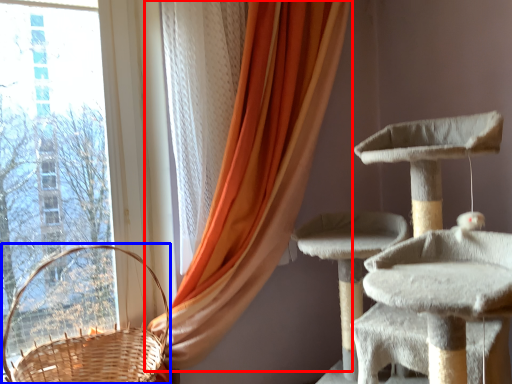
Question: Which of the following is the farthest to the observer, curtain (highlighted by a red box) or basket (highlighted by a blue box)?

Choices:
 (A) curtain
 (B) basket

Answer: (A)